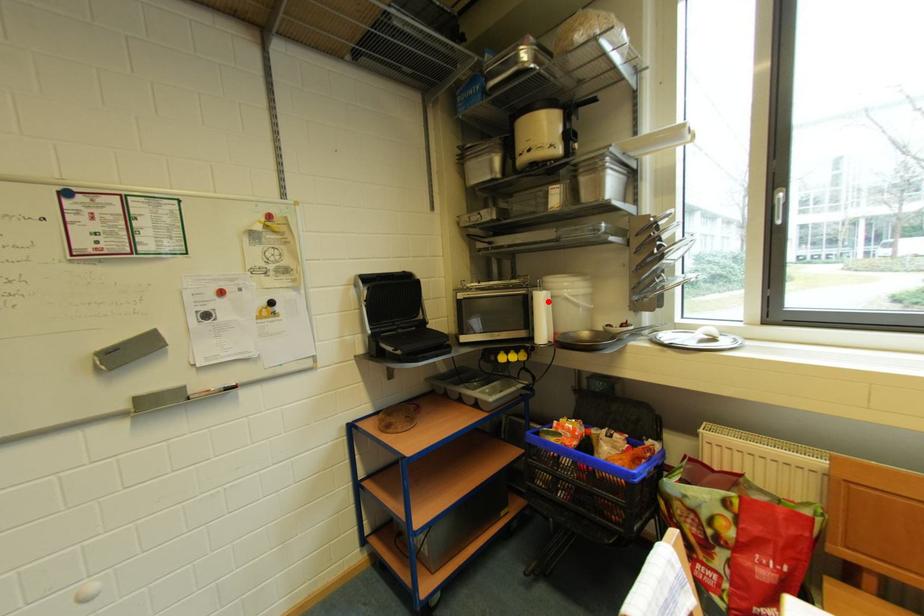
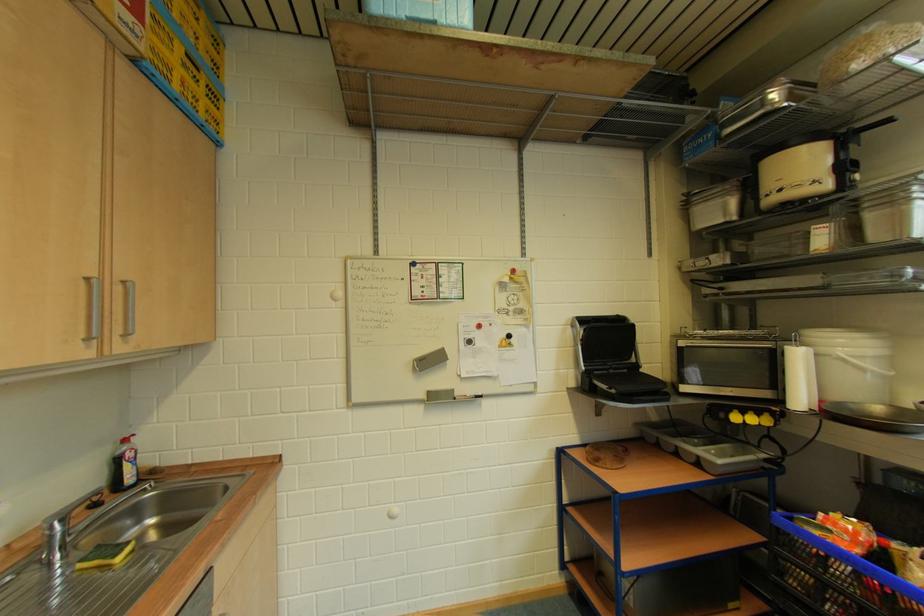
Where in the second image is the point corresponding to the highlighted location from the first image?

(805, 359)